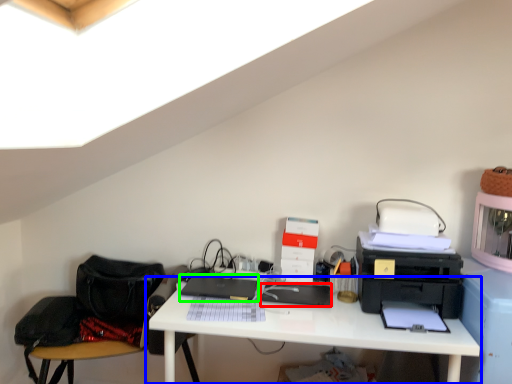
Question: Which object is the farthest from register (highlighted by a red box)? Choose among these: desk (highlighted by a blue box) or laptop (highlighted by a green box).

Choices:
 (A) desk
 (B) laptop

Answer: (B)